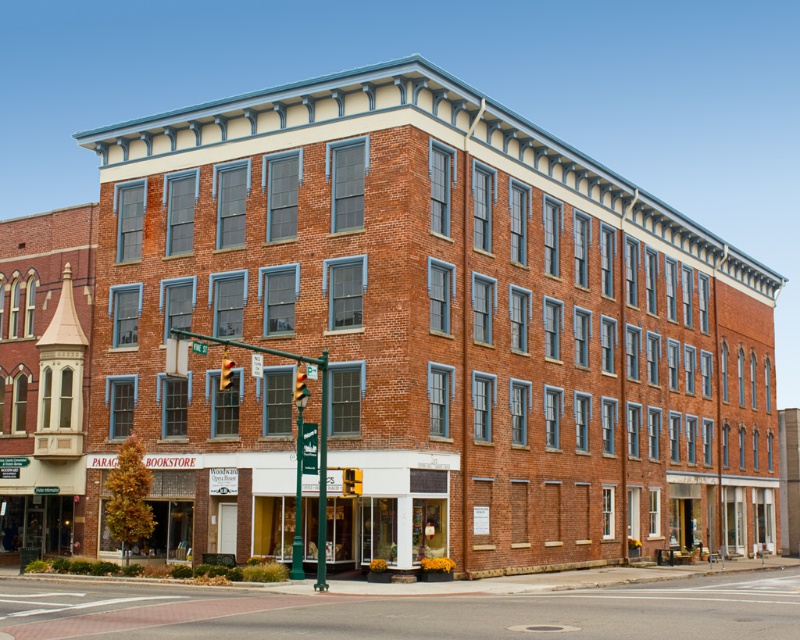
You are standing at the corner of the street where the three story brick building is located. You want to take a photo of the yellow plastic traffic light at center from exactly 100 feet away. Is the current distance you are at sufficient?

The yellow plastic traffic light at center is currently 103.22 feet away from the camera, which is slightly more than 100 feet. Therefore, you are at a sufficient distance to take the photo.

You are driving a car that is 15 feet long. You see the smooth asphalt road at lower center and the red glass traffic light at center in the image. Is there enough space to park your car between them?

The distance between the smooth asphalt road at lower center and the red glass traffic light at center is 36.33 feet. Since your car is 15 feet long, there is sufficient space to park between them.

You are a delivery driver who needs to park your car on the smooth asphalt road at lower center. However, there is a yellow plastic traffic light at upper center nearby. Can you safely park your car without blocking the traffic light?

The smooth asphalt road at lower center is larger in size than yellow plastic traffic light at upper center, so yes, you can park your car on the smooth asphalt road at lower center without blocking the traffic light as the road is large enough to accommodate the car while keeping it away from the traffic light.